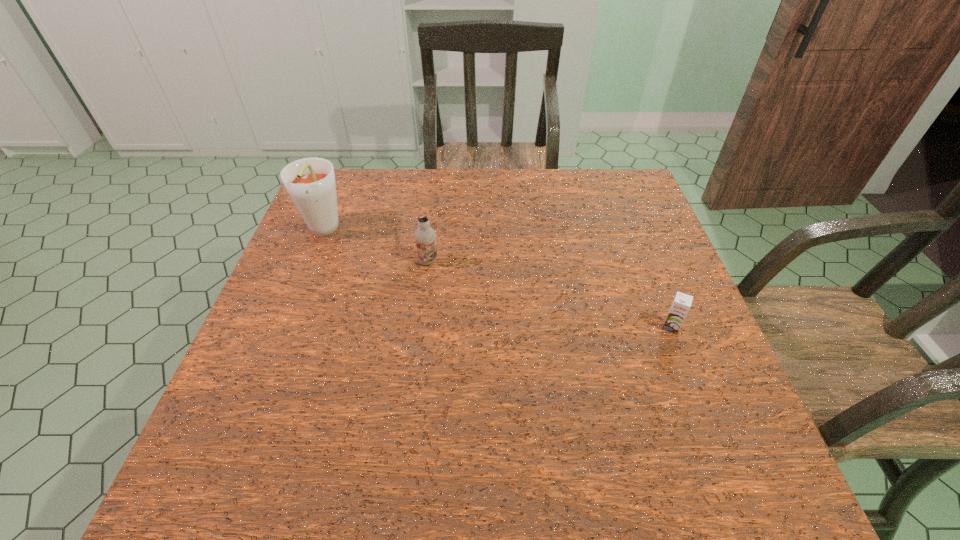
Identify the location of vacant area between the second tallest object and the shorter chocolate milk. point(549,294).

Locate an element on the screen. Image resolution: width=960 pixels, height=540 pixels. vacant area that lies between the root beer and the farther chocolate milk is located at coordinates (375, 247).

Image resolution: width=960 pixels, height=540 pixels. Identify the location of free space that is in between the shortest object and the taller chocolate milk. click(x=549, y=294).

Identify the location of free spot between the second farthest object and the root beer. The image size is (960, 540). (375, 247).

The width and height of the screenshot is (960, 540). I want to click on free space that is in between the farthest object and the shorter chocolate milk, so click(x=496, y=280).

The width and height of the screenshot is (960, 540). In order to click on free space between the nearer chocolate milk and the tallest object in this screenshot , I will do `click(496, 280)`.

Locate an element on the screen. free space between the leftmost object and the nearest object is located at coordinates (496, 280).

Identify the location of free area in between the second nearest object and the nearest object. Image resolution: width=960 pixels, height=540 pixels. (549, 294).

Find the location of a particular element. This screenshot has width=960, height=540. free space between the second shortest object and the farthest object is located at coordinates (375, 247).

Where is `vacant area between the farthest object and the farther chocolate milk`? vacant area between the farthest object and the farther chocolate milk is located at coordinates (375, 247).